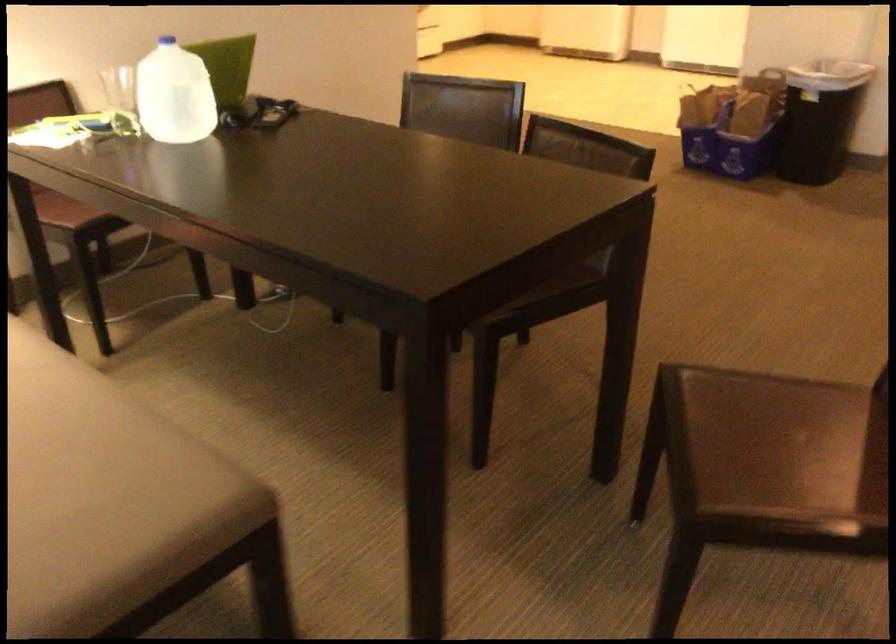
What do you see at coordinates (56, 451) in the screenshot? This screenshot has height=644, width=896. I see `the bench sitting surface` at bounding box center [56, 451].